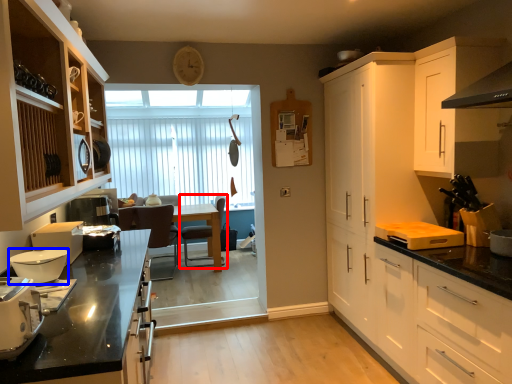
Question: Which object appears farthest to the camera in this image, chair (highlighted by a red box) or kitchen appliance (highlighted by a blue box)?

Choices:
 (A) chair
 (B) kitchen appliance

Answer: (A)